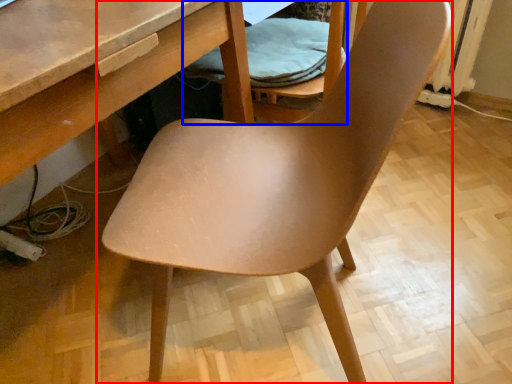
Question: Which of the following is the closest to the observer, chair (highlighted by a red box) or folding chair (highlighted by a blue box)?

Choices:
 (A) chair
 (B) folding chair

Answer: (A)